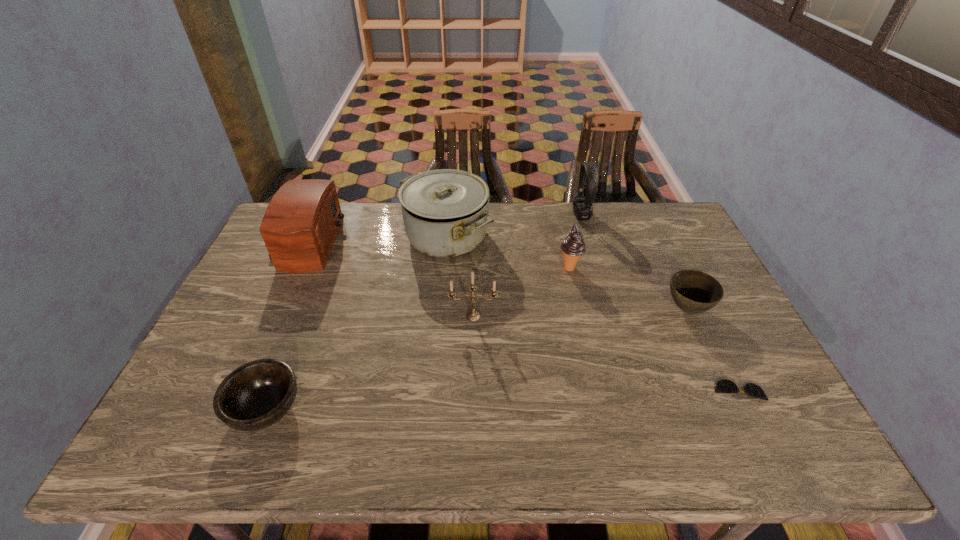
The image size is (960, 540). Find the location of `vacant space that's between the headset and the saucepan`. vacant space that's between the headset and the saucepan is located at coordinates (515, 226).

Locate an element on the screen. The width and height of the screenshot is (960, 540). empty space between the second shortest object and the saucepan is located at coordinates (356, 323).

You are a GUI agent. You are given a task and a screenshot of the screen. Output one action in this format:
    pyautogui.click(x=<x>, y=<y>)
    Task: Click on the free space between the right bowl and the fourth object from right to left
    The image size is (960, 540).
    Given the screenshot: What is the action you would take?
    pyautogui.click(x=628, y=288)

Locate an element on the screen. This screenshot has width=960, height=540. vacant area between the spectacles and the sixth object from left to right is located at coordinates (660, 303).

Where is `free space that is in between the shortest object and the candle`? This screenshot has width=960, height=540. free space that is in between the shortest object and the candle is located at coordinates tap(606, 354).

Where is `the second closest object to the fourth object from right to left`? The width and height of the screenshot is (960, 540). the second closest object to the fourth object from right to left is located at coordinates (446, 212).

Identify which object is the second closest to the radio receiver. Please provide its 2D coordinates. Your answer should be formatted as a tuple, i.e. [(x, y)], where the tuple contains the x and y coordinates of a point satisfying the conditions above.

[(256, 395)]

Identify the location of blank space that satisfies the following two spatial constraints: 1. on the back side of the nearer bowl; 2. on the left side of the shortest object. Image resolution: width=960 pixels, height=540 pixels. (x=274, y=390).

Find the location of a particular element. The height and width of the screenshot is (540, 960). free point that satisfies the following two spatial constraints: 1. on the back side of the spectacles; 2. on the right side of the seventh tallest object is located at coordinates (274, 390).

Locate an element on the screen. Image resolution: width=960 pixels, height=540 pixels. free region that satisfies the following two spatial constraints: 1. on the front-facing side of the radio receiver; 2. on the back side of the farther bowl is located at coordinates (273, 309).